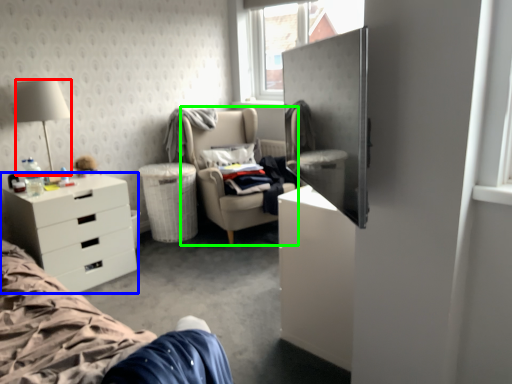
Question: Which is farther away from lamp (highlighted by a red box)? desk (highlighted by a blue box) or chair (highlighted by a green box)?

Choices:
 (A) desk
 (B) chair

Answer: (B)